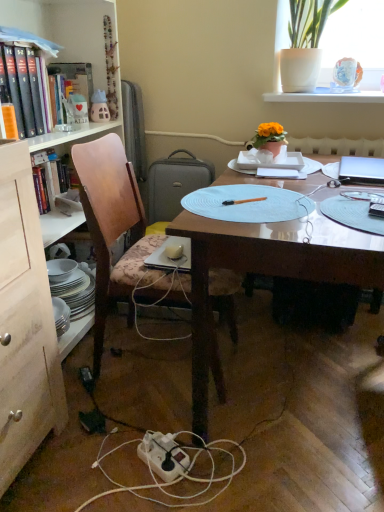
This screenshot has height=512, width=384. I want to click on vacant area that lies between wooden chair at left and white plastic power outlet at lower center, so 138,415.